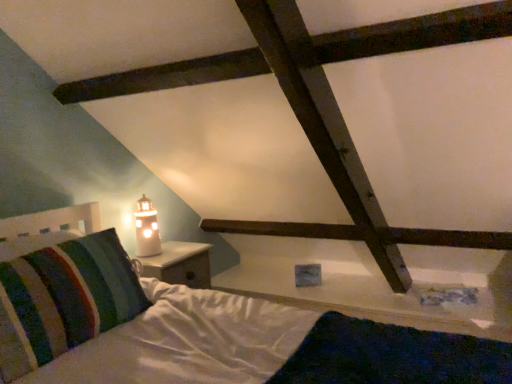
Find the location of a particular element. The height and width of the screenshot is (384, 512). matte glass lighthouse at left is located at coordinates (147, 229).

Describe the element at coordinates (147, 229) in the screenshot. This screenshot has width=512, height=384. I see `matte glass lighthouse at left` at that location.

What is the approximate height of matte glass lighthouse at left?

It is 33.97 centimeters.

You are a GUI agent. You are given a task and a screenshot of the screen. Output one action in this format:
    pyautogui.click(x=<x>, y=<y>)
    Task: Click on the striped fabric pillow at left
    
    Given the screenshot: What is the action you would take?
    pyautogui.click(x=64, y=299)

Describe the element at coordinates (64, 299) in the screenshot. This screenshot has width=512, height=384. I see `striped fabric pillow at left` at that location.

Identify the location of matte glass lighthouse at left. (147, 229).

Can you confirm if matte glass lighthouse at left is positioned to the right of striped fabric pillow at left?

Yes, matte glass lighthouse at left is to the right of striped fabric pillow at left.

Relative to striped fabric pillow at left, is matte glass lighthouse at left in front or behind?

In the image, matte glass lighthouse at left appears behind striped fabric pillow at left.

Between point (154, 245) and point (68, 266), which one is positioned behind?

Positioned behind is point (154, 245).

From the image's perspective, is matte glass lighthouse at left located above or below striped fabric pillow at left?

matte glass lighthouse at left is above striped fabric pillow at left.

From a real-world perspective, is matte glass lighthouse at left physically located above or below striped fabric pillow at left?

matte glass lighthouse at left is situated higher than striped fabric pillow at left in the real world.

Between matte glass lighthouse at left and striped fabric pillow at left, which one has smaller width?

Thinner between the two is matte glass lighthouse at left.

Considering the sizes of objects matte glass lighthouse at left and striped fabric pillow at left in the image provided, who is taller, matte glass lighthouse at left or striped fabric pillow at left?

striped fabric pillow at left.

Considering the relative sizes of matte glass lighthouse at left and striped fabric pillow at left in the image provided, is matte glass lighthouse at left smaller than striped fabric pillow at left?

Yes, matte glass lighthouse at left is smaller than striped fabric pillow at left.

Would you say matte glass lighthouse at left is outside striped fabric pillow at left?

Yes, matte glass lighthouse at left is located beyond the bounds of striped fabric pillow at left.

Is matte glass lighthouse at left next to striped fabric pillow at left and touching it?

No, matte glass lighthouse at left is not making contact with striped fabric pillow at left.

Is matte glass lighthouse at left oriented away from striped fabric pillow at left?

No, matte glass lighthouse at left's orientation is not away from striped fabric pillow at left.

Measure the distance from matte glass lighthouse at left to striped fabric pillow at left.

The distance of matte glass lighthouse at left from striped fabric pillow at left is 83.61 centimeters.

You are a GUI agent. You are given a task and a screenshot of the screen. Output one action in this format:
    pyautogui.click(x=<x>, y=<y>)
    Task: Click on the pillow in front of the matte glass lighthouse at left
    The height and width of the screenshot is (384, 512).
    Given the screenshot: What is the action you would take?
    pyautogui.click(x=64, y=299)

Considering the relative positions of striped fabric pillow at left and matte glass lighthouse at left in the image provided, is striped fabric pillow at left to the right of matte glass lighthouse at left from the viewer's perspective?

No, striped fabric pillow at left is not to the right of matte glass lighthouse at left.

Is striped fabric pillow at left further to camera compared to matte glass lighthouse at left?

No, striped fabric pillow at left is in front of matte glass lighthouse at left.

Is point (76, 275) closer or farther from the camera than point (144, 239)?

Clearly, point (76, 275) is closer to the camera than point (144, 239).

Based on the photo, from the image's perspective, is striped fabric pillow at left positioned above or below matte glass lighthouse at left?

striped fabric pillow at left is situated lower than matte glass lighthouse at left in the image.

Consider the image. From a real-world perspective, which object rests below the other?

striped fabric pillow at left.

Considering the sizes of striped fabric pillow at left and matte glass lighthouse at left in the image, is striped fabric pillow at left wider or thinner than matte glass lighthouse at left?

In the image, striped fabric pillow at left appears to be wider than matte glass lighthouse at left.

Considering the relative sizes of striped fabric pillow at left and matte glass lighthouse at left in the image provided, is striped fabric pillow at left taller than matte glass lighthouse at left?

Correct, striped fabric pillow at left is much taller as matte glass lighthouse at left.

In terms of size, does striped fabric pillow at left appear bigger or smaller than matte glass lighthouse at left?

Clearly, striped fabric pillow at left is larger in size than matte glass lighthouse at left.

From the picture: Is matte glass lighthouse at left completely or partially inside striped fabric pillow at left?

No.

Are striped fabric pillow at left and matte glass lighthouse at left beside each other?

They are not placed beside each other.

Is striped fabric pillow at left facing towards matte glass lighthouse at left?

No, striped fabric pillow at left is not facing towards matte glass lighthouse at left.

Measure the distance between striped fabric pillow at left and matte glass lighthouse at left.

striped fabric pillow at left and matte glass lighthouse at left are 83.61 centimeters apart from each other.

Locate an element on the screen. This screenshot has width=512, height=384. table lamp to the right of striped fabric pillow at left is located at coordinates (147, 229).

You are a GUI agent. You are given a task and a screenshot of the screen. Output one action in this format:
    pyautogui.click(x=<x>, y=<y>)
    Task: Click on the pillow in front of the matte glass lighthouse at left
    The image size is (512, 384).
    Given the screenshot: What is the action you would take?
    pyautogui.click(x=64, y=299)

Locate an element on the screen. Image resolution: width=512 pixels, height=384 pixels. pillow that appears below the matte glass lighthouse at left (from the image's perspective) is located at coordinates (64, 299).